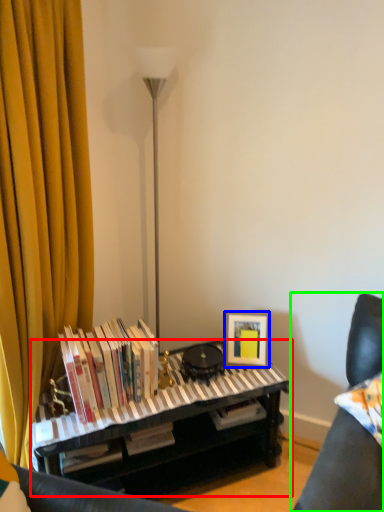
Question: Based on their relative distances, which object is farther from piano (highlighted by a red box)? Choose from picture frame (highlighted by a blue box) and furniture (highlighted by a green box).

Choices:
 (A) picture frame
 (B) furniture

Answer: (B)